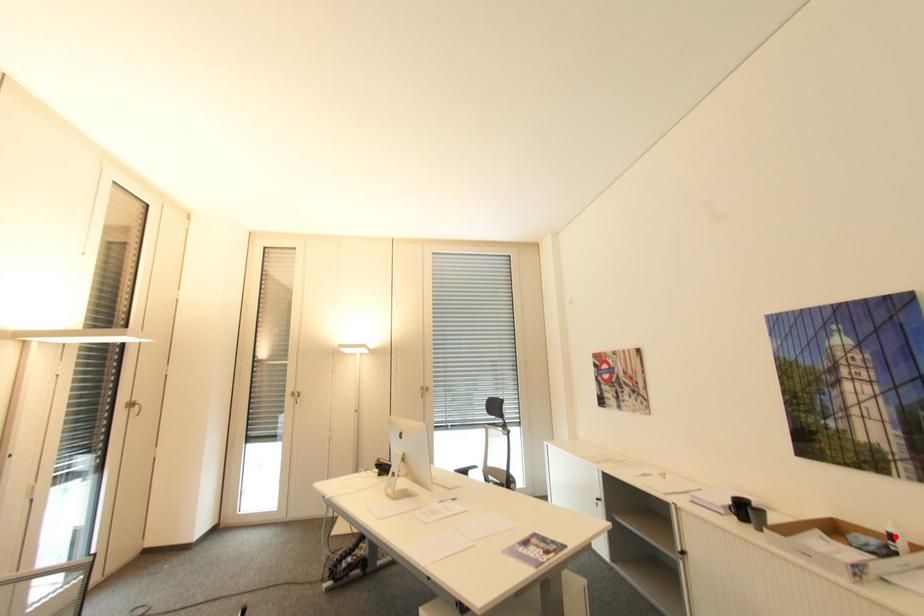
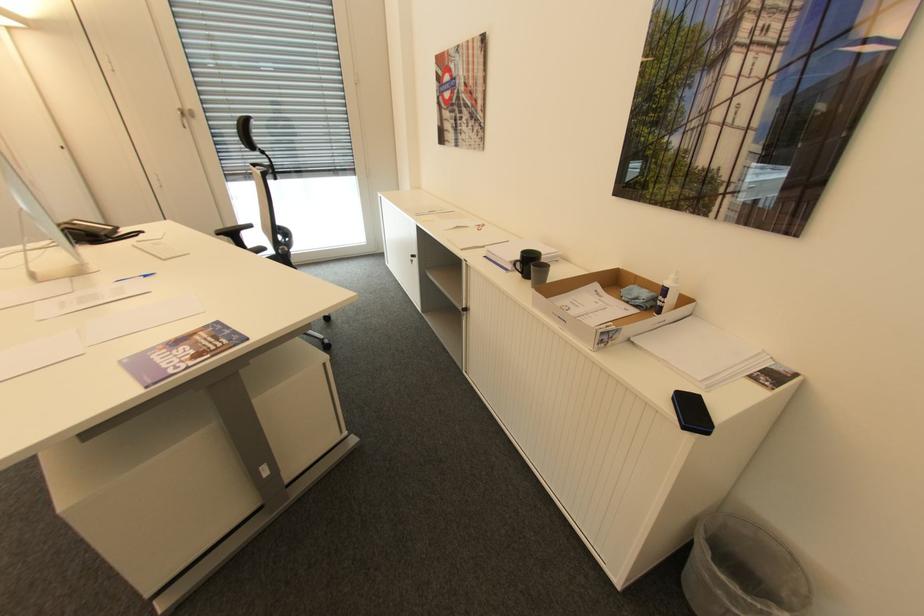
In the second image, find the point that corresponds to the highlighted location in the first image.

(670, 291)